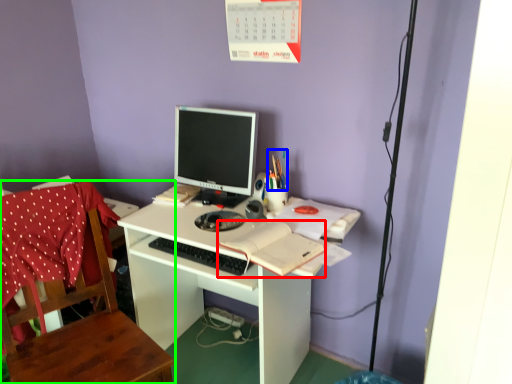
Question: Estimate the real-world distances between objects in this image. Which object is closer to notebook (highlighted by a red box), stationery (highlighted by a blue box) or chair (highlighted by a green box)?

Choices:
 (A) stationery
 (B) chair

Answer: (A)